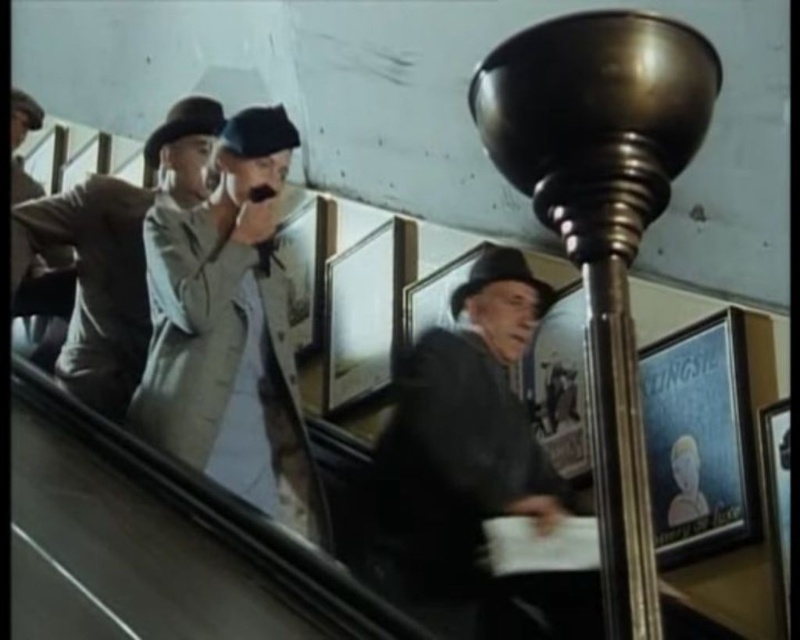
Question: Is dark gray wool coat at center positioned before light beige coat at left?

Choices:
 (A) no
 (B) yes

Answer: (B)

Question: Which point is farther from the camera taking this photo?

Choices:
 (A) (144, 276)
 (B) (274, 349)
 (C) (529, 632)

Answer: (A)

Question: Is dark gray wool coat at center above light beige coat at left?

Choices:
 (A) yes
 (B) no

Answer: (B)

Question: Which object is positioned farthest from the dark gray wool coat at center?

Choices:
 (A) light beige coat at left
 (B) light beige suit at center

Answer: (A)

Question: Is the position of dark gray wool coat at center less distant than that of light beige coat at left?

Choices:
 (A) yes
 (B) no

Answer: (A)

Question: Which point is closer to the camera taking this photo?

Choices:
 (A) coord(270,468)
 (B) coord(448,460)

Answer: (B)